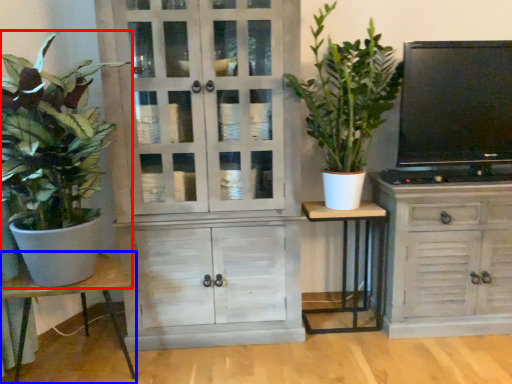
Question: Which point is further to the camera, houseplant (highlighted by a red box) or table (highlighted by a blue box)?

Choices:
 (A) houseplant
 (B) table

Answer: (B)